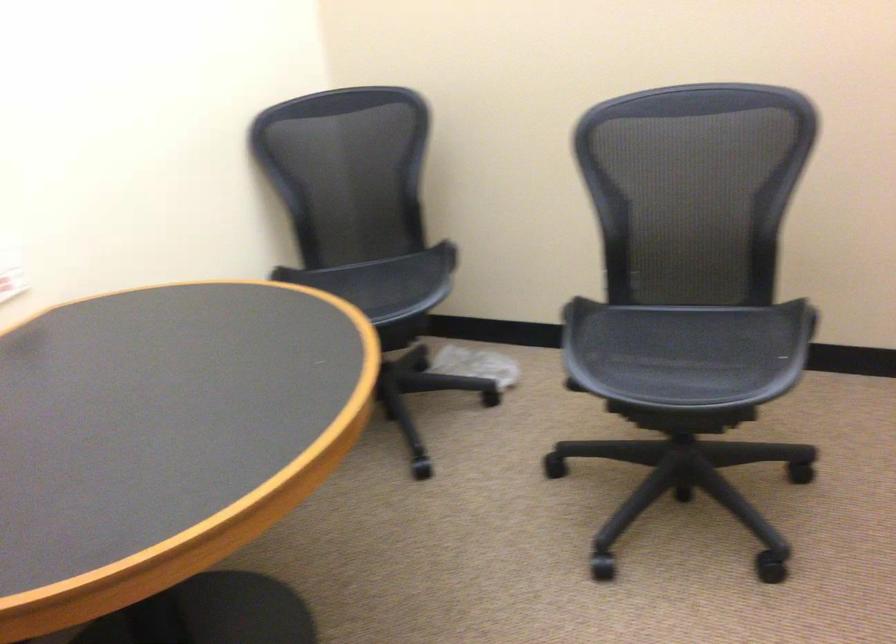
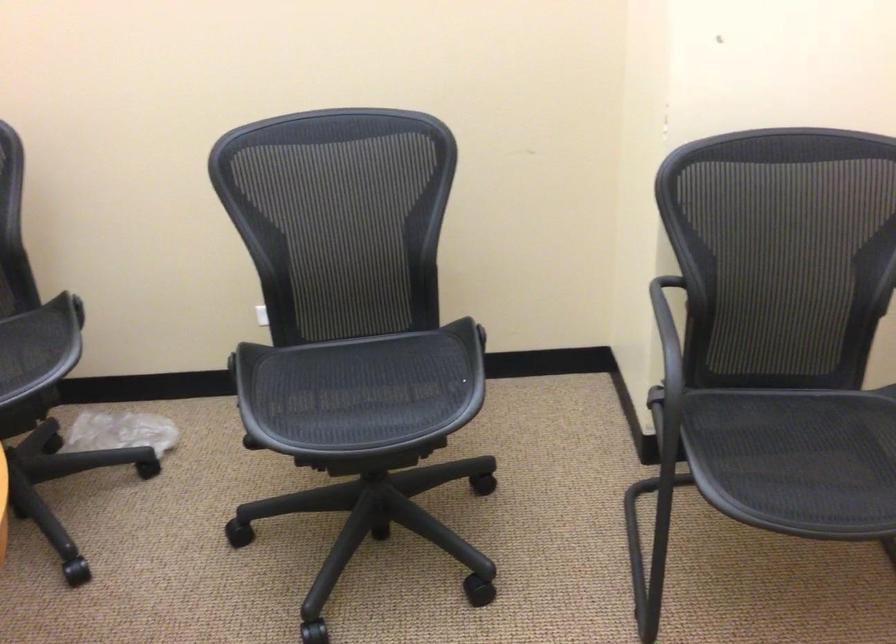
The images are taken continuously from a first-person perspective. In which direction are you moving?

The cameraman walked toward left, forward.